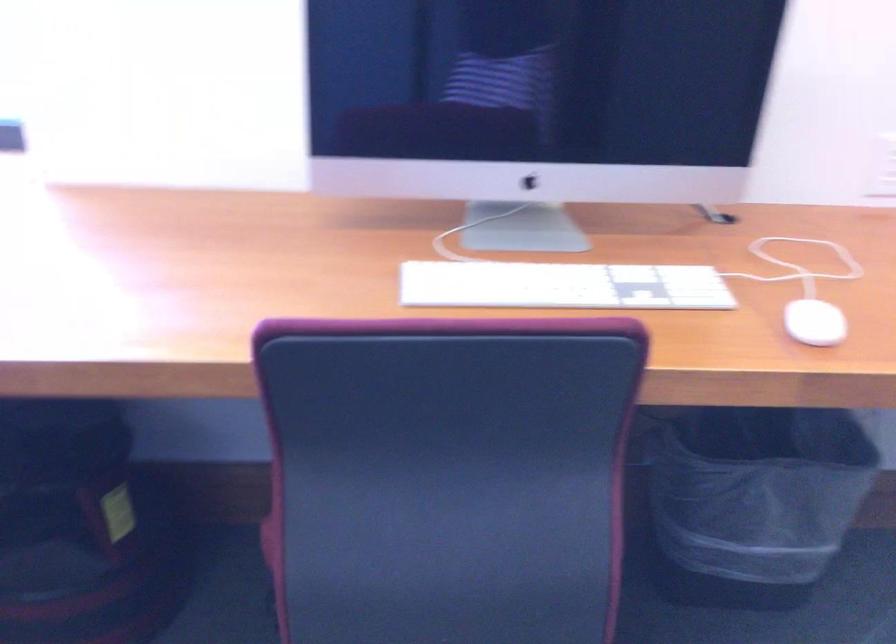
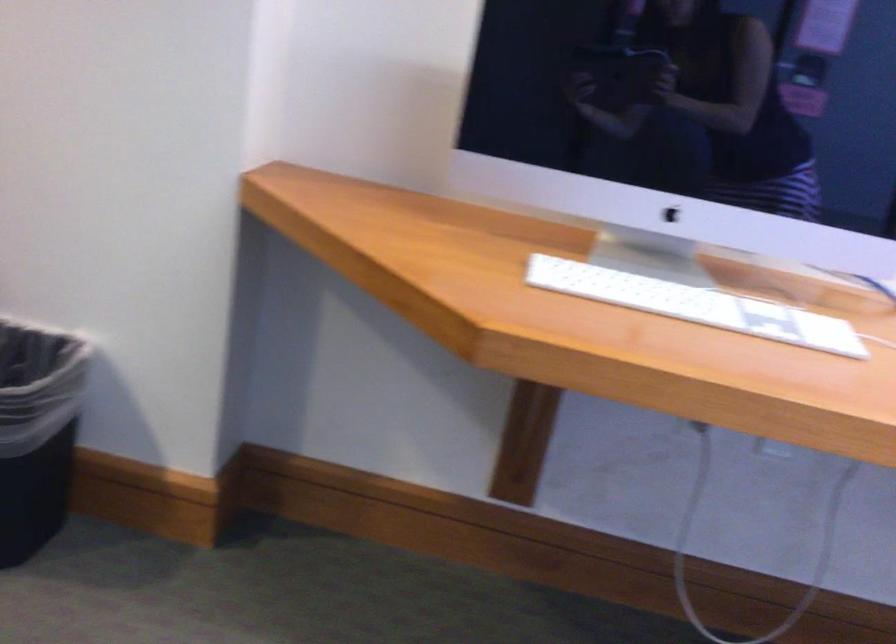
Question: The images are taken continuously from a first-person perspective. In which direction are you moving?

Choices:
 (A) Left
 (B) Right
 (C) Forward
 (D) Backward

Answer: (A)